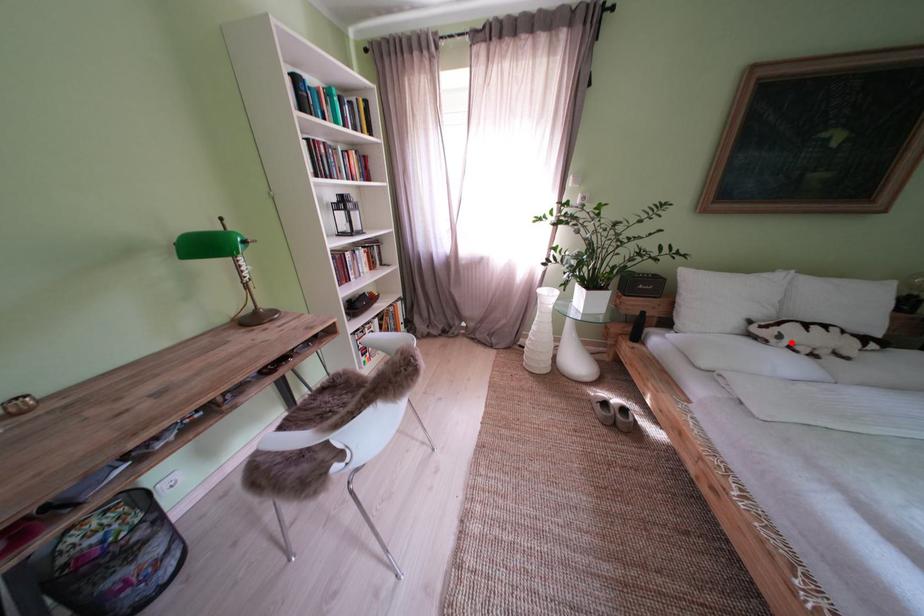
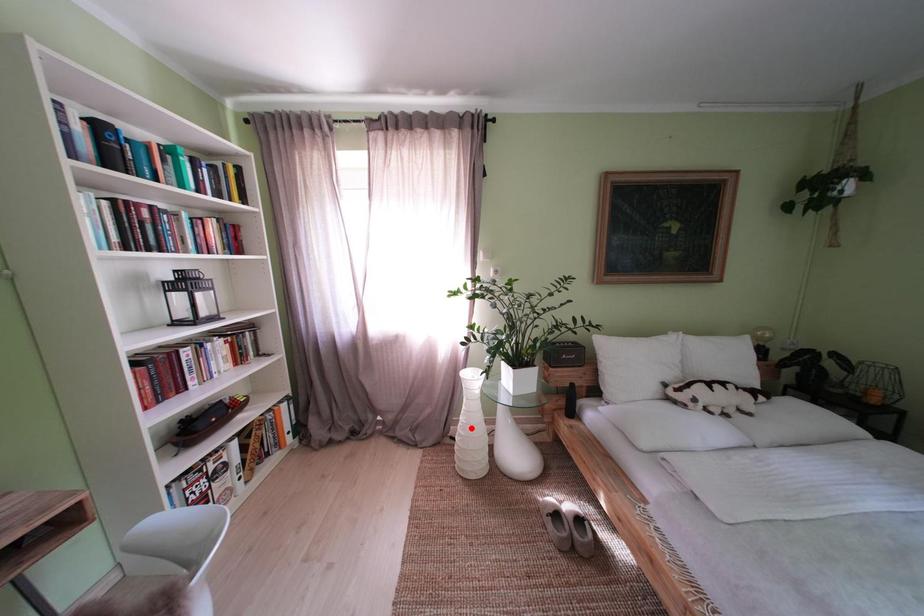
I am providing you with two images of the same scene from different viewpoints. A red point is marked on the first image and another point is marked on the second image. Is the marked point in image1 the same physical position as the marked point in image2?

No